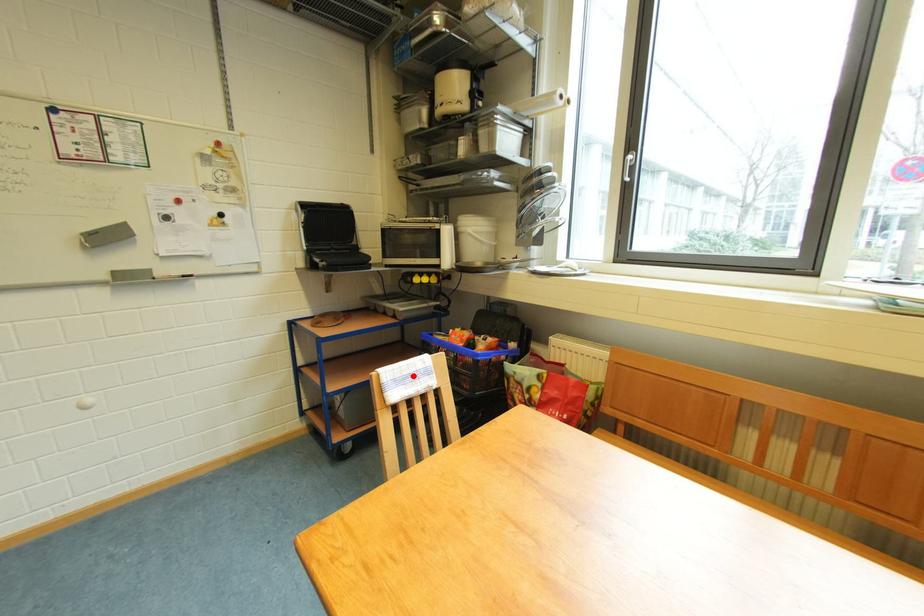
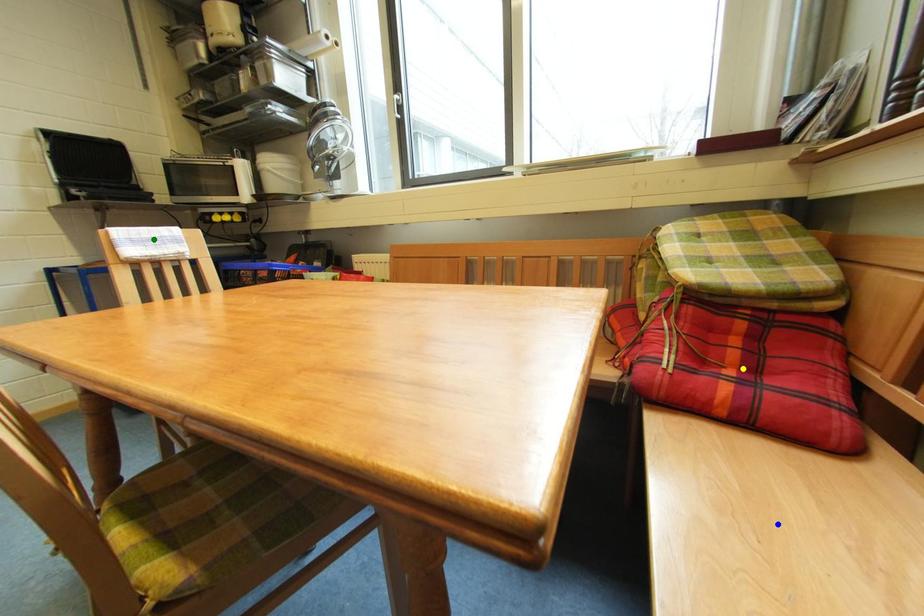
Question: I am providing you with two images of the same scene from different viewpoints. A red point is marked on the first image. You are given multiple points on the second image. Can you choose the point in image 2 that corresponds to the point in image 1?

Choices:
 (A) green point
 (B) yellow point
 (C) blue point

Answer: (A)